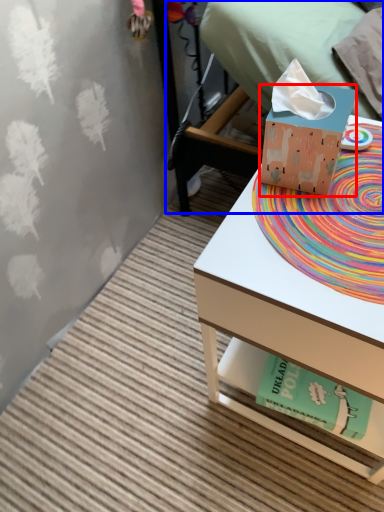
Question: Which object is further to the camera taking this photo, box (highlighted by a red box) or bed (highlighted by a blue box)?

Choices:
 (A) box
 (B) bed

Answer: (B)